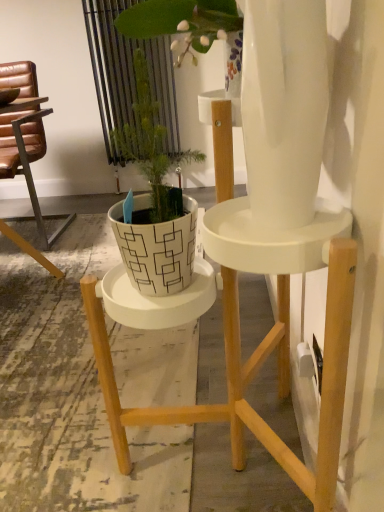
This screenshot has height=512, width=384. Describe the element at coordinates (26, 152) in the screenshot. I see `brown leather chair at left` at that location.

Measure the distance between brown leather chair at left and camera.

A distance of 6.05 feet exists between brown leather chair at left and camera.

What is the approximate width of brown leather chair at left?

It is 25.64 inches.

The width and height of the screenshot is (384, 512). In order to click on brown leather chair at left in this screenshot , I will do `click(26, 152)`.

What is the approximate height of white matte pot at center?

14.88 inches.

Measure the distance between white matte pot at center and camera.

white matte pot at center and camera are 24.73 inches apart from each other.

The width and height of the screenshot is (384, 512). Identify the location of white matte pot at center. (154, 202).

What do you see at coordinates (154, 202) in the screenshot? This screenshot has height=512, width=384. I see `white matte pot at center` at bounding box center [154, 202].

What are the coordinates of `brown leather chair at left` in the screenshot? It's located at (26, 152).

Based on their positions, is brown leather chair at left located to the left or right of white matte pot at center?

In the image, brown leather chair at left appears on the left side of white matte pot at center.

Considering their positions, is brown leather chair at left located in front of or behind white matte pot at center?

Visually, brown leather chair at left is located behind white matte pot at center.

Is point (32, 110) positioned in front of point (152, 216)?

That is False.

From the image's perspective, is brown leather chair at left located above or below white matte pot at center?

brown leather chair at left is situated higher than white matte pot at center in the image.

From a real-world perspective, which is physically above, brown leather chair at left or white matte pot at center?

From a 3D spatial view, white matte pot at center is above.

Can you confirm if brown leather chair at left is thinner than white matte pot at center?

In fact, brown leather chair at left might be wider than white matte pot at center.

Can you confirm if brown leather chair at left is shorter than white matte pot at center?

No, brown leather chair at left is not shorter than white matte pot at center.

From the picture: Does brown leather chair at left have a larger size compared to white matte pot at center?

Yes, brown leather chair at left is bigger than white matte pot at center.

Is brown leather chair at left inside the boundaries of white matte pot at center, or outside?

brown leather chair at left lies outside white matte pot at center.

From the picture: Is brown leather chair at left positioned far away from white matte pot at center?

Yes, brown leather chair at left and white matte pot at center are quite far apart.

Is brown leather chair at left turned away from white matte pot at center?

brown leather chair at left is not turned away from white matte pot at center.

Find the location of `houseplant that appears on the right of brown leather chair at left`. houseplant that appears on the right of brown leather chair at left is located at coordinates (154, 202).

Is white matte pot at center to the left or to the right of brown leather chair at left in the image?

Clearly, white matte pot at center is on the right of brown leather chair at left in the image.

Looking at this image, is white matte pot at center further to the viewer compared to brown leather chair at left?

No, it is in front of brown leather chair at left.

Which is behind, point (166, 170) or point (40, 140)?

Point (40, 140)

From the image's perspective, would you say white matte pot at center is positioned over brown leather chair at left?

No.

From a real-world perspective, is white matte pot at center physically below brown leather chair at left?

No.

Does white matte pot at center have a greater width compared to brown leather chair at left?

Incorrect, the width of white matte pot at center does not surpass that of brown leather chair at left.

Considering the sizes of objects white matte pot at center and brown leather chair at left in the image provided, who is taller, white matte pot at center or brown leather chair at left?

With more height is brown leather chair at left.

Which of these two, white matte pot at center or brown leather chair at left, is bigger?

brown leather chair at left is bigger.

Is white matte pot at center outside of brown leather chair at left?

white matte pot at center lies outside brown leather chair at left's area.

Is white matte pot at center not near brown leather chair at left?

white matte pot at center is positioned a significant distance from brown leather chair at left.

Is white matte pot at center oriented towards brown leather chair at left?

No, white matte pot at center does not turn towards brown leather chair at left.

How many degrees apart are the facing directions of white matte pot at center and brown leather chair at left?

They differ by 90.4 degrees in their facing directions.

How far apart are white matte pot at center and brown leather chair at left?

white matte pot at center is 1.42 meters away from brown leather chair at left.

I want to click on chair behind the white matte pot at center, so click(x=26, y=152).

You are a GUI agent. You are given a task and a screenshot of the screen. Output one action in this format:
    pyautogui.click(x=<x>, y=<y>)
    Task: Click on the chair on the left of white matte pot at center
    
    Given the screenshot: What is the action you would take?
    pyautogui.click(x=26, y=152)

This screenshot has width=384, height=512. In order to click on chair that is under the white matte pot at center (from a real-world perspective) in this screenshot , I will do `click(26, 152)`.